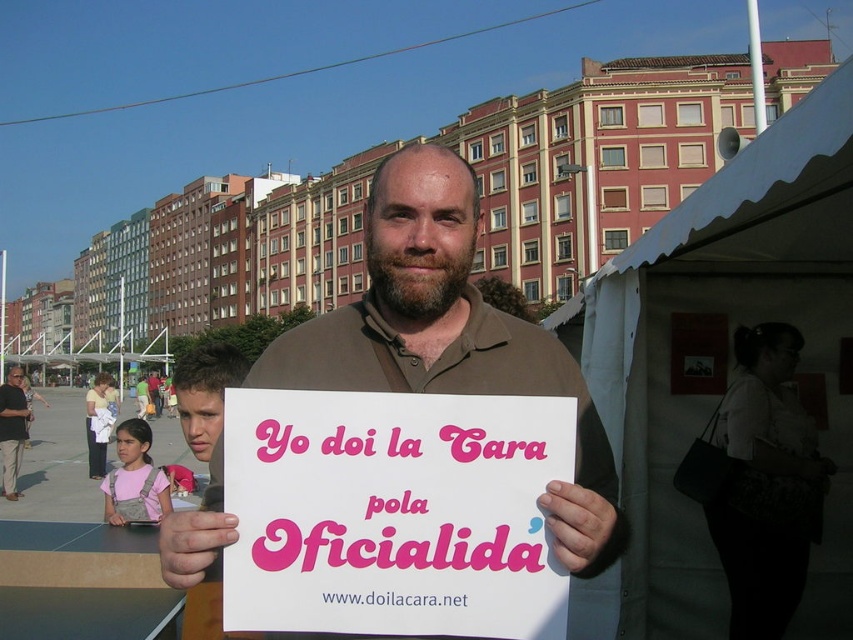
Does point (434, 577) come in front of point (22, 374)?

Yes, it is in front of point (22, 374).

The image size is (853, 640). What are the coordinates of `pink paper sign at center` in the screenshot? It's located at click(393, 513).

Locate an element on the screen. pink paper sign at center is located at coordinates (393, 513).

Does point (477, 307) lie behind point (4, 390)?

No, (477, 307) is in front of (4, 390).

Does brown cotton shirt at center lie in front of matte black shirt at lower left?

That is True.

Find the location of a particular element. brown cotton shirt at center is located at coordinates (450, 339).

The image size is (853, 640). What are the coordinates of `brown cotton shirt at center` in the screenshot? It's located at (450, 339).

In the scene shown: Which is more to the right, pink paper sign at center or brown cotton shirt at center?

From the viewer's perspective, brown cotton shirt at center appears more on the right side.

Is pink paper sign at center thinner than brown cotton shirt at center?

Indeed, pink paper sign at center has a lesser width compared to brown cotton shirt at center.

Is point (477, 582) positioned after point (407, 147)?

No, (477, 582) is in front of (407, 147).

The width and height of the screenshot is (853, 640). In order to click on pink paper sign at center in this screenshot , I will do `click(393, 513)`.